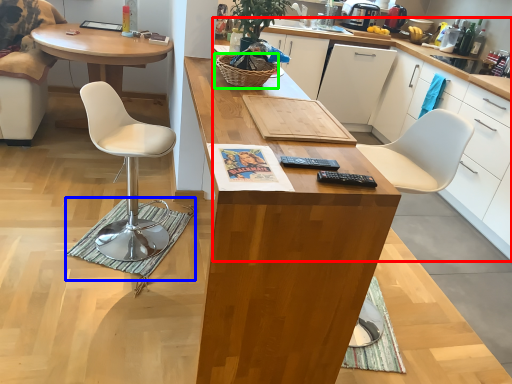
Question: Which object is positioned closest to cabinetry (highlighted by a red box)? Select from mat (highlighted by a blue box) and picnic basket (highlighted by a green box).

Choices:
 (A) mat
 (B) picnic basket

Answer: (B)